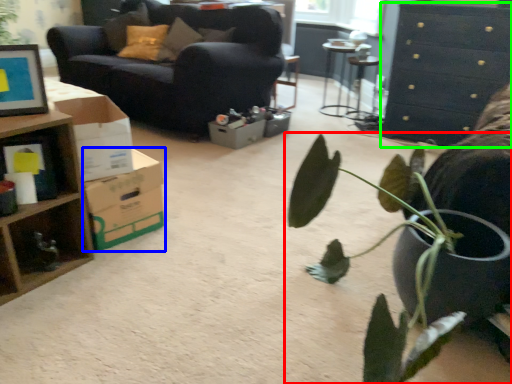
Question: Which object is the farthest from houseplant (highlighted by a red box)? Choose among these: cardboard box (highlighted by a blue box) or chest of drawers (highlighted by a green box).

Choices:
 (A) cardboard box
 (B) chest of drawers

Answer: (B)